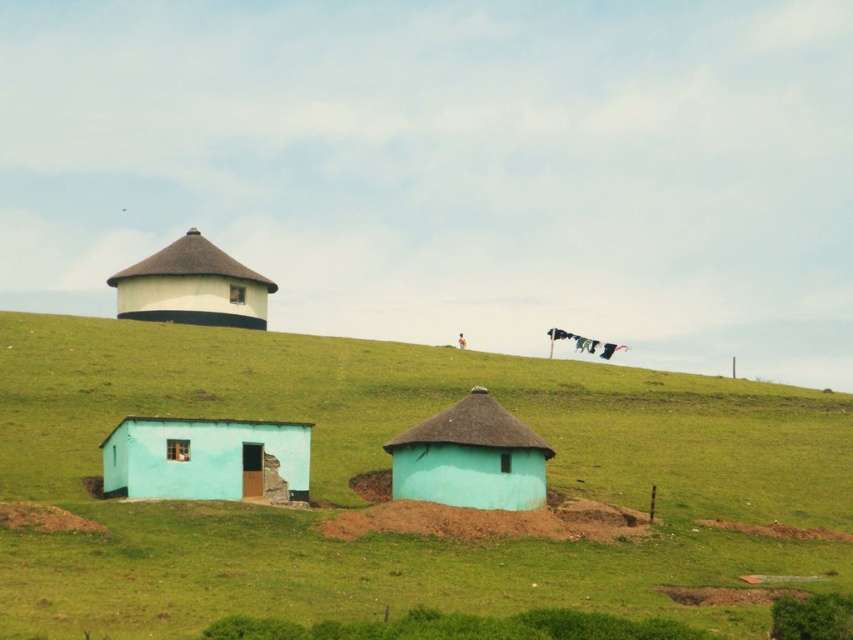
You are standing at the edge of the pasture and want to walk to the light blue clay hut at lower left. Which direction should you move relative to the green grassy at lower center?

You should move to the left of the green grassy at lower center to reach the light blue clay hut at lower left, since the green grassy at lower center is located to the right of the light blue clay hut at lower left.

You are standing in the middle of the pasture in the rural landscape scene. There is a point marked at coordinates point (x=515, y=506). Can you determine if you can reach this point without walking more than 200 feet?

The point (x=515, y=506) is 197.76 feet from the viewer, so yes, you can reach it without exceeding the 200 feet limit.